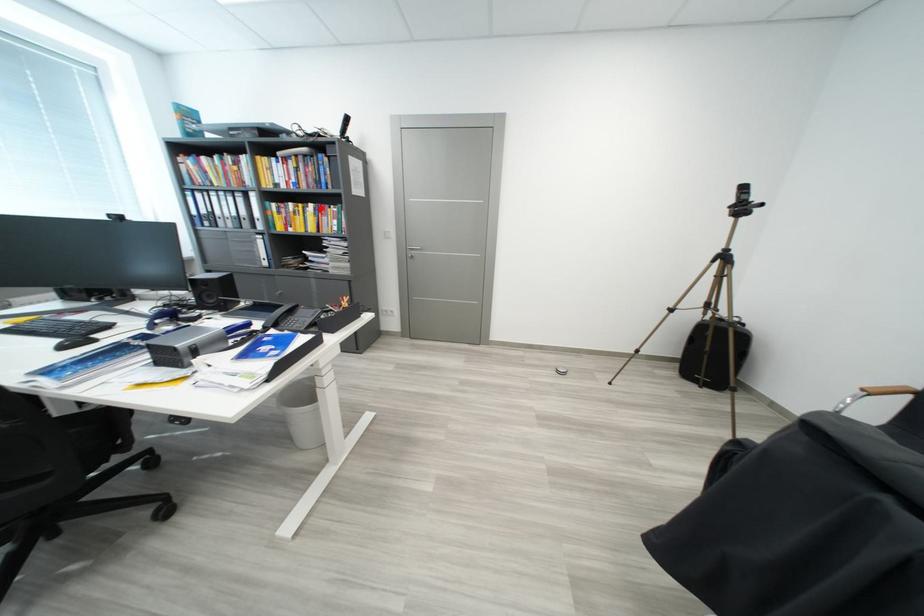
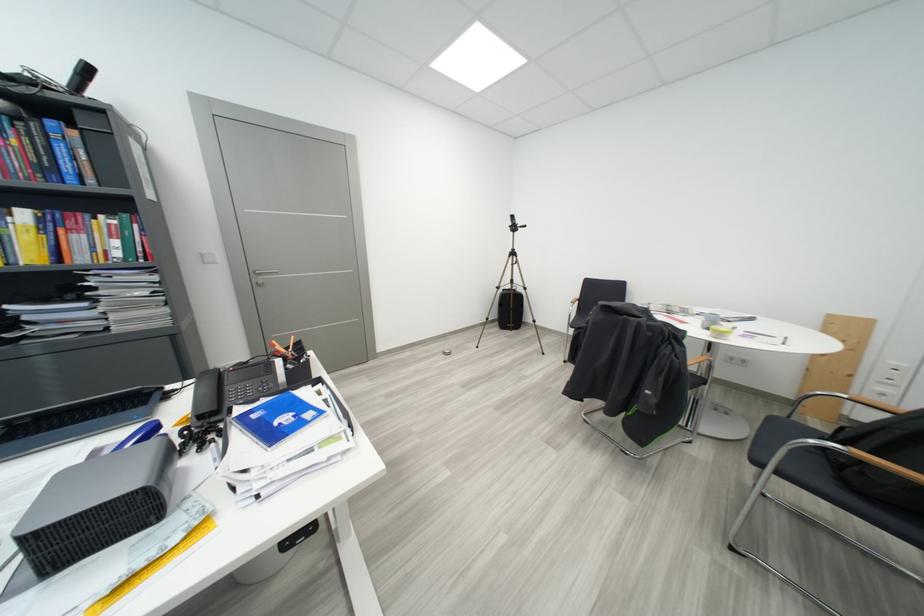
Question: I am providing you with two images of the same scene from different viewpoints. A red point is shown in image1. For the corresponding object point in image2, is it positioned nearer or farther from the camera?

Choices:
 (A) Nearer
 (B) Farther

Answer: (B)